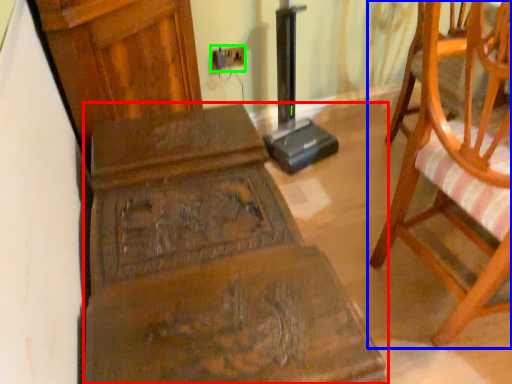
Question: Considering the real-world distances, which object is closest to furniture (highlighted by a red box)? chair (highlighted by a blue box) or electric outlet (highlighted by a green box).

Choices:
 (A) chair
 (B) electric outlet

Answer: (A)